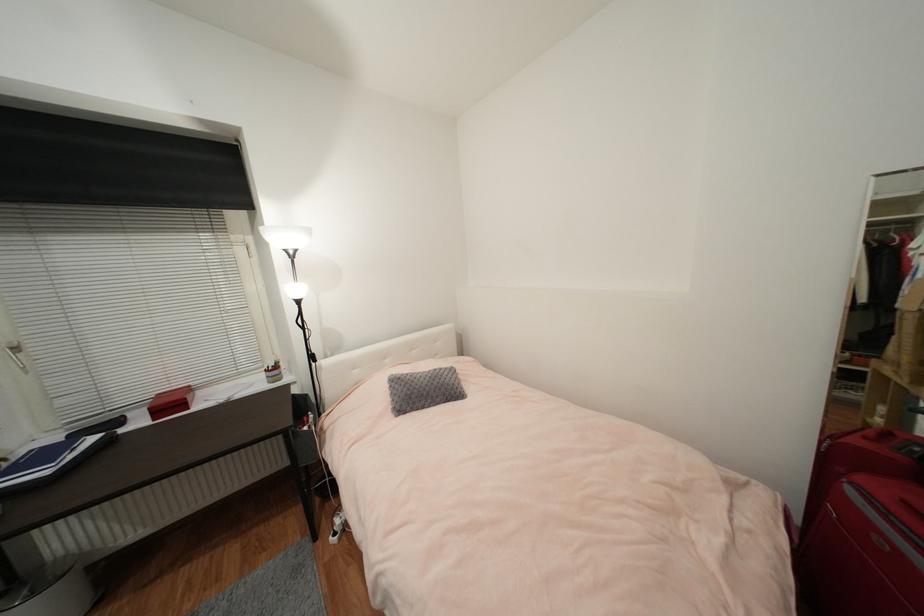
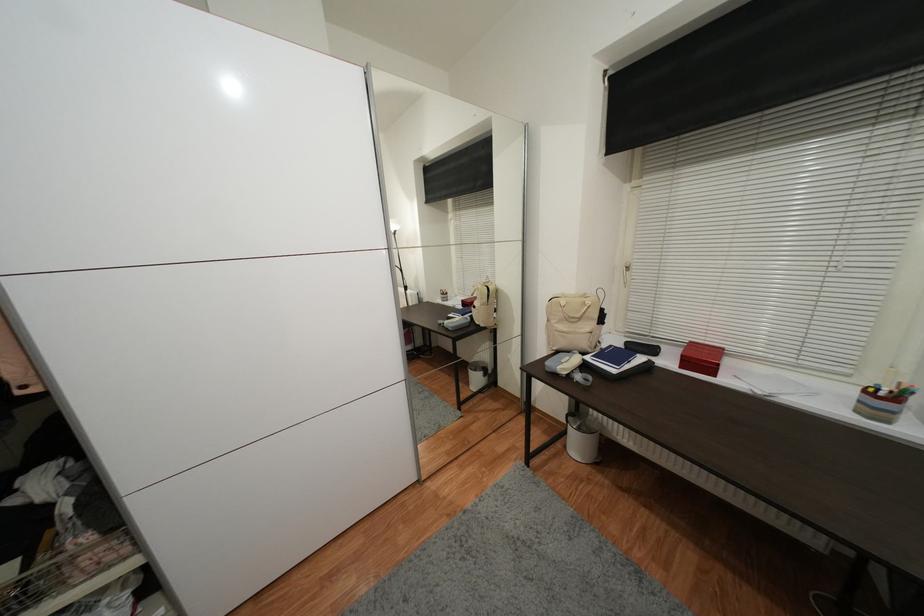
Based on the continuous images, in which direction is the camera rotating?

The camera's rotation is toward left-down.